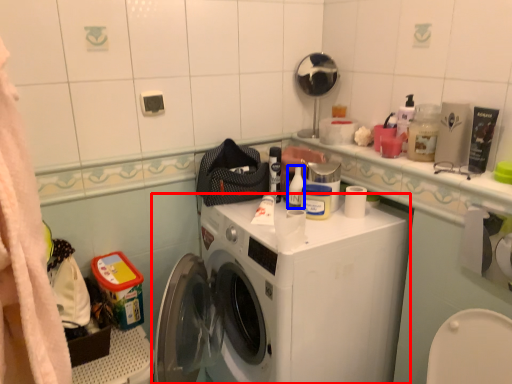
Question: Which object is closer to the camera taking this photo, washing machine (highlighted by a red box) or toiletry (highlighted by a blue box)?

Choices:
 (A) washing machine
 (B) toiletry

Answer: (A)